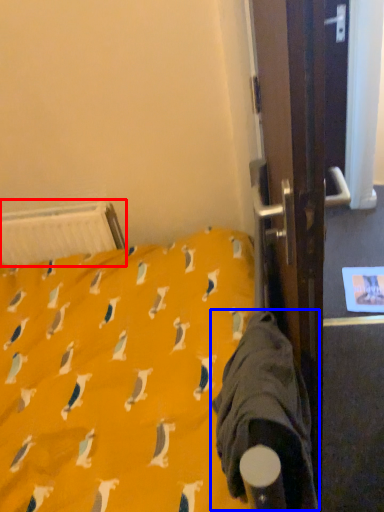
Question: Among these objects, which one is farthest to the camera, radiator (highlighted by a red box) or sleeping bag (highlighted by a blue box)?

Choices:
 (A) radiator
 (B) sleeping bag

Answer: (A)